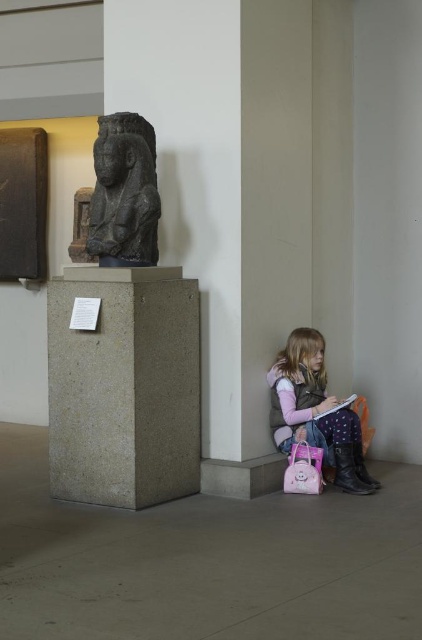
Can you confirm if gray concrete pillar at center is positioned below pink matte book at lower right?

Actually, gray concrete pillar at center is above pink matte book at lower right.

Between point (127, 467) and point (338, 408), which one is positioned in front?

Point (127, 467) is more forward.

Where is `gray concrete pillar at center`? This screenshot has width=422, height=640. gray concrete pillar at center is located at coordinates (124, 387).

In the scene shown: Is black stone statue at left above pink matte book at lower right?

Indeed, black stone statue at left is positioned over pink matte book at lower right.

Does black stone statue at left have a smaller size compared to pink matte book at lower right?

Actually, black stone statue at left might be larger than pink matte book at lower right.

Is point (146, 228) in front of point (345, 401)?

That is True.

You are a GUI agent. You are given a task and a screenshot of the screen. Output one action in this format:
    pyautogui.click(x=<x>, y=<y>)
    Task: Click on the black stone statue at left
    Image resolution: width=422 pixels, height=640 pixels.
    Given the screenshot: What is the action you would take?
    pyautogui.click(x=124, y=193)

Is point (89, 360) positioned behind point (321, 432)?

That is False.

Which is more to the left, gray concrete pillar at center or matte pink backpack at lower right?

gray concrete pillar at center is more to the left.

Between point (149, 448) and point (306, 326), which one is positioned in front?

Positioned in front is point (149, 448).

You are a GUI agent. You are given a task and a screenshot of the screen. Output one action in this format:
    pyautogui.click(x=<x>, y=<y>)
    Task: Click on the gray concrete pillar at center
    The image size is (422, 640).
    Given the screenshot: What is the action you would take?
    pyautogui.click(x=124, y=387)